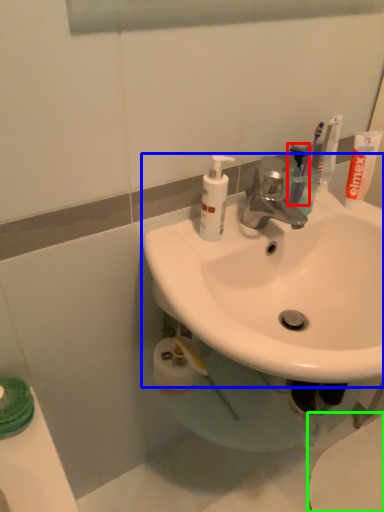
Question: Estimate the real-world distances between objects in this image. Which object is closer to toothbrush (highlighted by a red box), sink (highlighted by a blue box) or toilet (highlighted by a green box)?

Choices:
 (A) sink
 (B) toilet

Answer: (A)